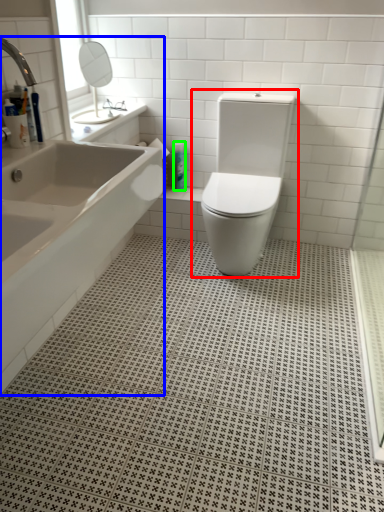
Question: Which object is the farthest from toilet (highlighted by a red box)? Choose among these: bathtub (highlighted by a blue box) or toiletry (highlighted by a green box).

Choices:
 (A) bathtub
 (B) toiletry

Answer: (A)